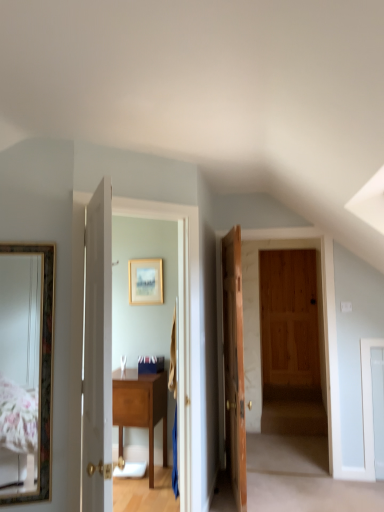
Question: Considering the positions of wooden door at center, arranged as the first door when viewed from the right, and gold-framed picture at center in the image, is wooden door at center, arranged as the first door when viewed from the right, taller or shorter than gold-framed picture at center?

Choices:
 (A) short
 (B) tall

Answer: (B)

Question: Looking at the image, does wooden door at center, which appears as the second door when viewed from the front, seem bigger or smaller compared to gold-framed picture at center?

Choices:
 (A) big
 (B) small

Answer: (A)

Question: Which of these objects is positioned closest to the gold-framed picture at center?

Choices:
 (A) wooden table at center
 (B) gold-framed mirror at left
 (C) white wooden door at center, positioned as the 2th door in right-to-left order
 (D) wooden door at center, which ranks as the second door in left-to-right order

Answer: (D)

Question: Which object is positioned farthest from the white wooden door at center, which is counted as the 1th door, starting from the front?

Choices:
 (A) wooden table at center
 (B) gold-framed picture at center
 (C) wooden door at center, which ranks as the second door in left-to-right order
 (D) gold-framed mirror at left

Answer: (B)